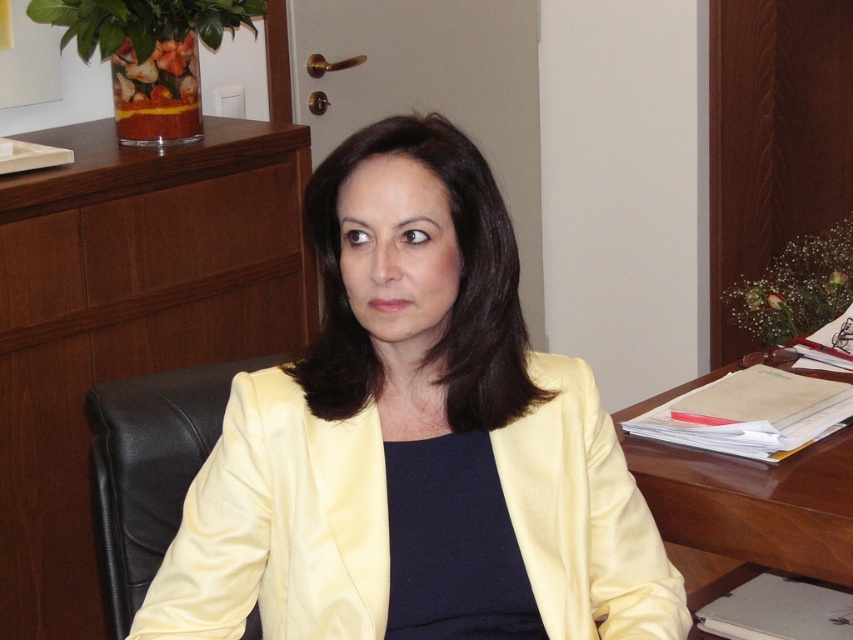
Question: Does satin yellow jacket at center have a smaller size compared to brown wooden table at right?

Choices:
 (A) yes
 (B) no

Answer: (A)

Question: Where is brown wooden table at right located in relation to black leather chair at left in the image?

Choices:
 (A) above
 (B) below

Answer: (A)

Question: Is satin yellow jacket at center thinner than black leather chair at left?

Choices:
 (A) yes
 (B) no

Answer: (B)

Question: Based on their relative distances, which object is farther from the brown wood computer desk at upper center?

Choices:
 (A) brown wooden table at right
 (B) black leather chair at left
 (C) satin yellow jacket at center

Answer: (A)

Question: Which point is farther to the camera?

Choices:
 (A) (163, 250)
 (B) (248, 465)
 (C) (669, 394)
 (D) (184, 429)

Answer: (A)

Question: Estimate the real-world distances between objects in this image. Which object is farther from the black leather chair at left?

Choices:
 (A) brown wooden table at right
 (B) brown wood computer desk at upper center
 (C) satin yellow jacket at center

Answer: (A)